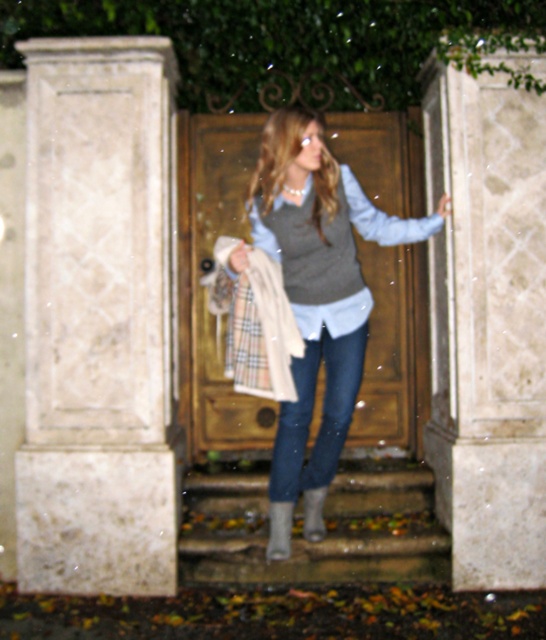
In the scene shown: You are a delivery person trying to reach the wooden door at the top of the steps. You notice the white marble pillar at left and the gray woolen sweater at center. Which object is bigger in size?

The white marble pillar at left is larger in size compared to the gray woolen sweater at center.